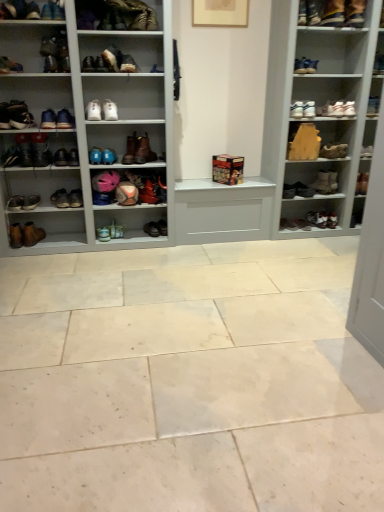
Image resolution: width=384 pixels, height=512 pixels. What are the coordinates of `vacant space positioned to the left of matte blue sneaker at center, acting as the 15th shoe starting from the right` in the screenshot? It's located at [91, 237].